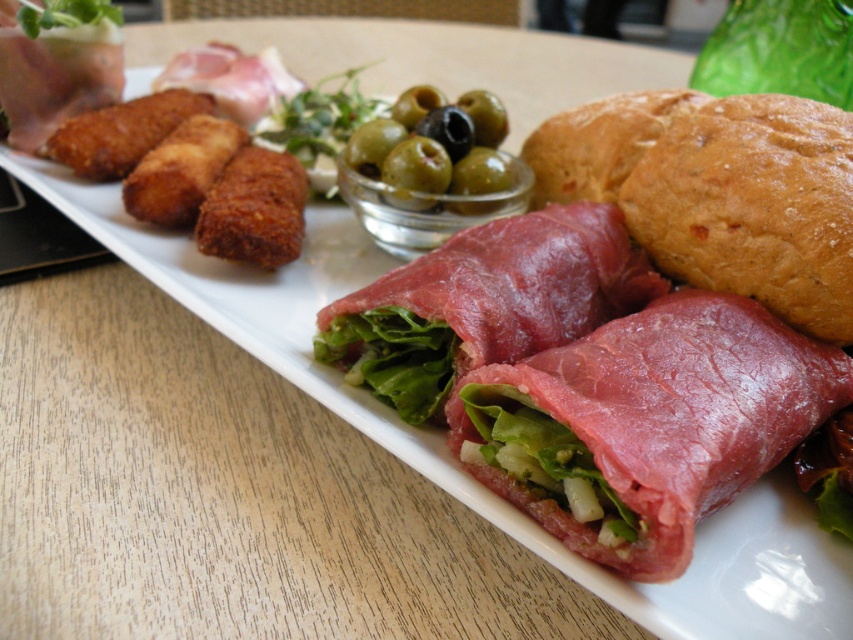
Which is below, golden brown crusty bread at upper right or fried golden-brown croquette at center-left?

fried golden-brown croquette at center-left

Between point (675, 104) and point (252, 232), which one is positioned behind?

The point (675, 104) is more distant.

Describe the element at coordinates (599, 144) in the screenshot. I see `golden brown crusty bread at upper right` at that location.

Locate an element on the screen. This screenshot has height=640, width=853. golden brown crusty bread at upper right is located at coordinates (599, 144).

What do you see at coordinates (254, 209) in the screenshot?
I see `fried golden-brown croquette at center-left` at bounding box center [254, 209].

Who is positioned more to the left, fried golden-brown croquette at center-left or fried golden-brown croquette at upper left?

Positioned to the left is fried golden-brown croquette at upper left.

Does point (241, 205) lie in front of point (210, 147)?

Yes.

You are a GUI agent. You are given a task and a screenshot of the screen. Output one action in this format:
    pyautogui.click(x=<x>, y=<y>)
    Task: Click on the fried golden-brown croquette at center-left
    This screenshot has height=640, width=853.
    Given the screenshot: What is the action you would take?
    pyautogui.click(x=254, y=209)

Can you confirm if pink raw meat at center is positioned below fried golden-brown croquette at center-left?

Indeed, pink raw meat at center is positioned under fried golden-brown croquette at center-left.

Is pink raw meat at center smaller than fried golden-brown croquette at center-left?

No.

Is point (323, 333) more distant than point (256, 250)?

No.

The height and width of the screenshot is (640, 853). What are the coordinates of `pink raw meat at center` in the screenshot? It's located at (485, 304).